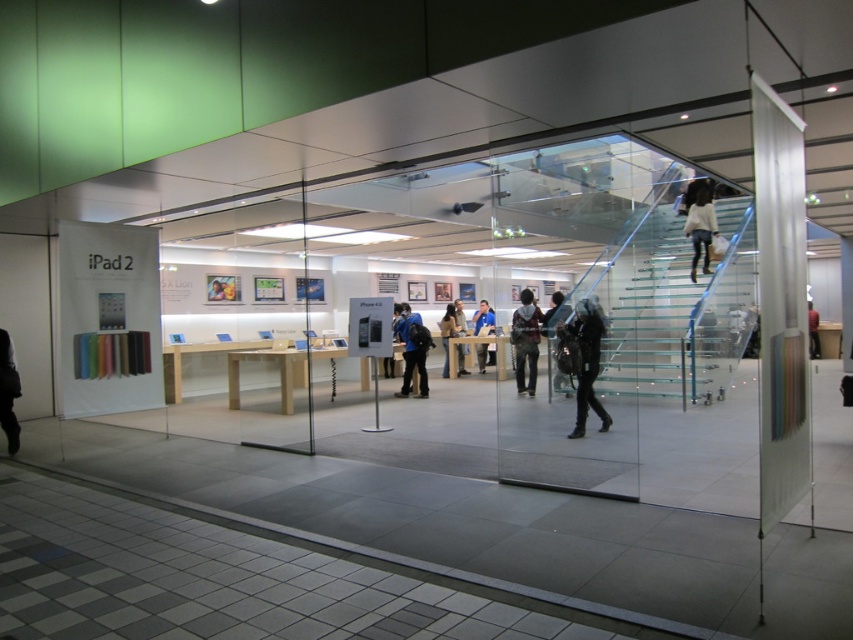
You are a customer entering the Apple Store through the entrance near the green accent wall. You need to locate both the dark blue jeans at upper right and the blue fabric jacket at center. Which item should you look for first as you enter the store?

You should look for the blue fabric jacket at center first because the dark blue jeans at upper right is to the right of it, meaning the jacket is closer to the entrance near the green accent wall.

You are a customer entering the Apple Store through the entrance near the green accent wall. You notice two items displayed on the tables inside the store. Which item is taller between the dark blue jeans at upper right and the blue fabric jacket at center?

The dark blue jeans at upper right is taller than the blue fabric jacket at center.